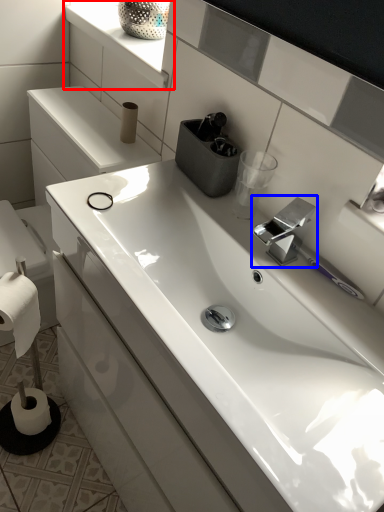
Question: Among these objects, which one is nearest to the camera, window sill (highlighted by a red box) or tap (highlighted by a blue box)?

Choices:
 (A) window sill
 (B) tap

Answer: (B)